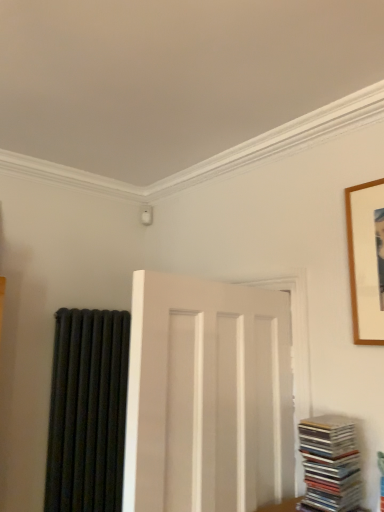
Question: Is white matte door at center smaller than stacked glossy cds at lower right?

Choices:
 (A) yes
 (B) no

Answer: (B)

Question: Is stacked glossy cds at lower right at the back of white matte door at center?

Choices:
 (A) no
 (B) yes

Answer: (B)

Question: From the image's perspective, is white matte door at center above stacked glossy cds at lower right?

Choices:
 (A) yes
 (B) no

Answer: (A)

Question: From a real-world perspective, is white matte door at center over stacked glossy cds at lower right?

Choices:
 (A) yes
 (B) no

Answer: (A)

Question: Can you confirm if white matte door at center is wider than stacked glossy cds at lower right?

Choices:
 (A) no
 (B) yes

Answer: (A)

Question: Considering the relative sizes of white matte door at center and stacked glossy cds at lower right in the image provided, is white matte door at center taller than stacked glossy cds at lower right?

Choices:
 (A) yes
 (B) no

Answer: (A)

Question: Is wooden picture frame at upper right far away from black matte radiator at left?

Choices:
 (A) yes
 (B) no

Answer: (A)

Question: From the image's perspective, would you say wooden picture frame at upper right is positioned over black matte radiator at left?

Choices:
 (A) no
 (B) yes

Answer: (B)

Question: Is wooden picture frame at upper right further to camera compared to black matte radiator at left?

Choices:
 (A) yes
 (B) no

Answer: (B)

Question: Are wooden picture frame at upper right and black matte radiator at left beside each other?

Choices:
 (A) yes
 (B) no

Answer: (B)

Question: Is wooden picture frame at upper right aimed at black matte radiator at left?

Choices:
 (A) no
 (B) yes

Answer: (A)

Question: Is wooden picture frame at upper right not within black matte radiator at left?

Choices:
 (A) yes
 (B) no

Answer: (A)

Question: From a real-world perspective, is stacked glossy cds at lower right under white matte door at center?

Choices:
 (A) yes
 (B) no

Answer: (A)